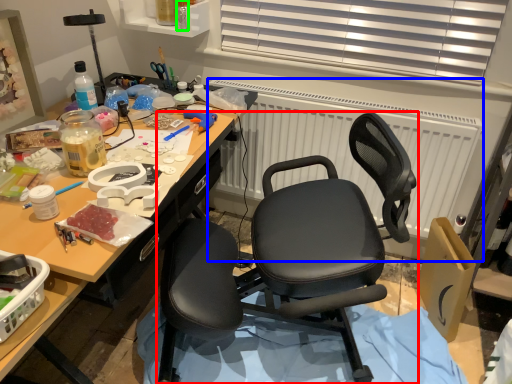
Question: Estimate the real-world distances between objects in this image. Which object is farther from chair (highlighted by a red box), radiator (highlighted by a blue box) or bottle (highlighted by a green box)?

Choices:
 (A) radiator
 (B) bottle

Answer: (B)